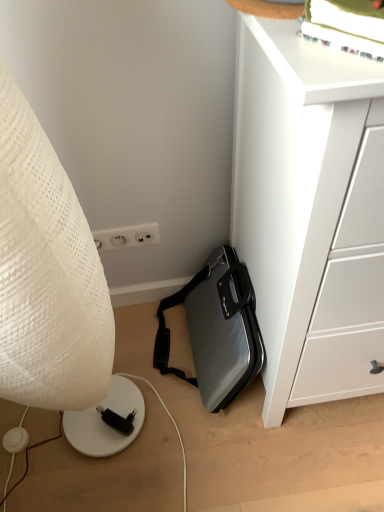
Question: Is white textured lamp at left at the right side of silver textured briefcase at lower center?

Choices:
 (A) yes
 (B) no

Answer: (B)

Question: Does white textured lamp at left have a greater width compared to silver textured briefcase at lower center?

Choices:
 (A) yes
 (B) no

Answer: (A)

Question: Does white textured lamp at left have a greater height compared to silver textured briefcase at lower center?

Choices:
 (A) yes
 (B) no

Answer: (A)

Question: Does white textured lamp at left have a lesser height compared to silver textured briefcase at lower center?

Choices:
 (A) yes
 (B) no

Answer: (B)

Question: Are white textured lamp at left and silver textured briefcase at lower center located far from each other?

Choices:
 (A) no
 (B) yes

Answer: (A)

Question: From a real-world perspective, is white textured lamp at left above or below silver textured briefcase at lower center?

Choices:
 (A) above
 (B) below

Answer: (A)

Question: Considering the positions of point (89, 306) and point (226, 272), is point (89, 306) closer or farther from the camera than point (226, 272)?

Choices:
 (A) closer
 (B) farther

Answer: (A)

Question: In the image, is white textured lamp at left on the left side or the right side of silver textured briefcase at lower center?

Choices:
 (A) right
 (B) left

Answer: (B)

Question: Looking at the image, does white textured lamp at left seem bigger or smaller compared to silver textured briefcase at lower center?

Choices:
 (A) small
 (B) big

Answer: (B)

Question: Looking at the image, does white matte chest of drawers at lower right seem bigger or smaller compared to silver textured briefcase at lower center?

Choices:
 (A) big
 (B) small

Answer: (A)

Question: From a real-world perspective, relative to silver textured briefcase at lower center, is white matte chest of drawers at lower right vertically above or below?

Choices:
 (A) above
 (B) below

Answer: (A)

Question: Relative to silver textured briefcase at lower center, is white matte chest of drawers at lower right in front or behind?

Choices:
 (A) behind
 (B) front

Answer: (B)

Question: Do you think white matte chest of drawers at lower right is within silver textured briefcase at lower center, or outside of it?

Choices:
 (A) outside
 (B) inside

Answer: (A)

Question: Does point (188, 294) appear closer or farther from the camera than point (9, 374)?

Choices:
 (A) closer
 (B) farther

Answer: (B)

Question: Is silver textured briefcase at lower center situated inside white textured lamp at left or outside?

Choices:
 (A) outside
 (B) inside

Answer: (A)